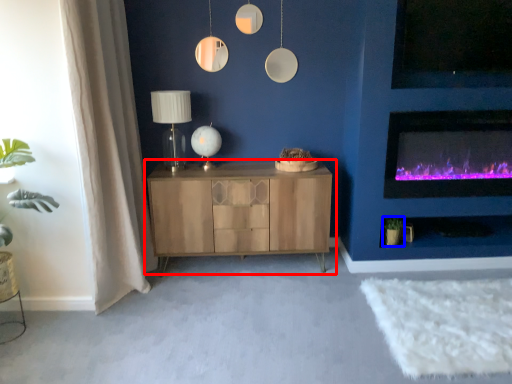
Question: Among these objects, which one is nearest to the camera, cabinetry (highlighted by a red box) or plant (highlighted by a blue box)?

Choices:
 (A) cabinetry
 (B) plant

Answer: (A)